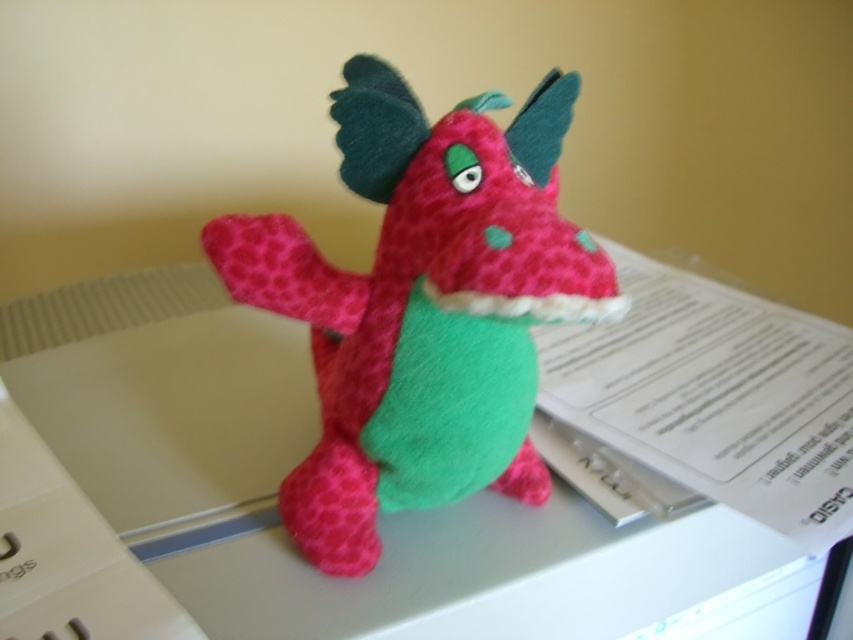
Question: Does felt table at center have a lesser width compared to matte pink plush dragon at center?

Choices:
 (A) yes
 (B) no

Answer: (B)

Question: Does felt table at center have a lesser width compared to matte pink plush dragon at center?

Choices:
 (A) yes
 (B) no

Answer: (B)

Question: Among these points, which one is nearest to the camera?

Choices:
 (A) (344, 92)
 (B) (225, 448)

Answer: (A)

Question: Can you confirm if felt table at center is positioned below matte pink plush dragon at center?

Choices:
 (A) yes
 (B) no

Answer: (A)